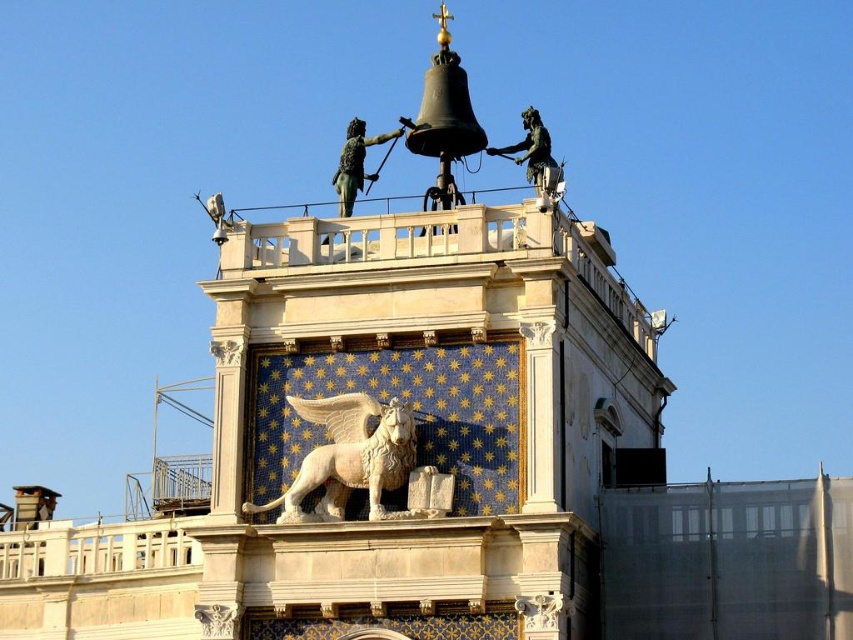
Question: Is white marble lion at center thinner than green polished bronze statue at upper center?

Choices:
 (A) yes
 (B) no

Answer: (A)

Question: Which of the following is the closest to the observer?

Choices:
 (A) (276, 518)
 (B) (502, 150)

Answer: (A)

Question: Does white marble tower at center have a smaller size compared to white marble lion at center?

Choices:
 (A) yes
 (B) no

Answer: (B)

Question: Can you confirm if white marble tower at center is bigger than green patinated bronze statue at upper center?

Choices:
 (A) yes
 (B) no

Answer: (A)

Question: Which is nearer to the white marble tower at center?

Choices:
 (A) green polished bronze statue at upper center
 (B) green patinated bronze statue at upper center
 (C) white marble lion at center

Answer: (B)

Question: Which object is farther from the camera taking this photo?

Choices:
 (A) white marble tower at center
 (B) white marble lion at center
 (C) green patinated bronze statue at upper center

Answer: (C)